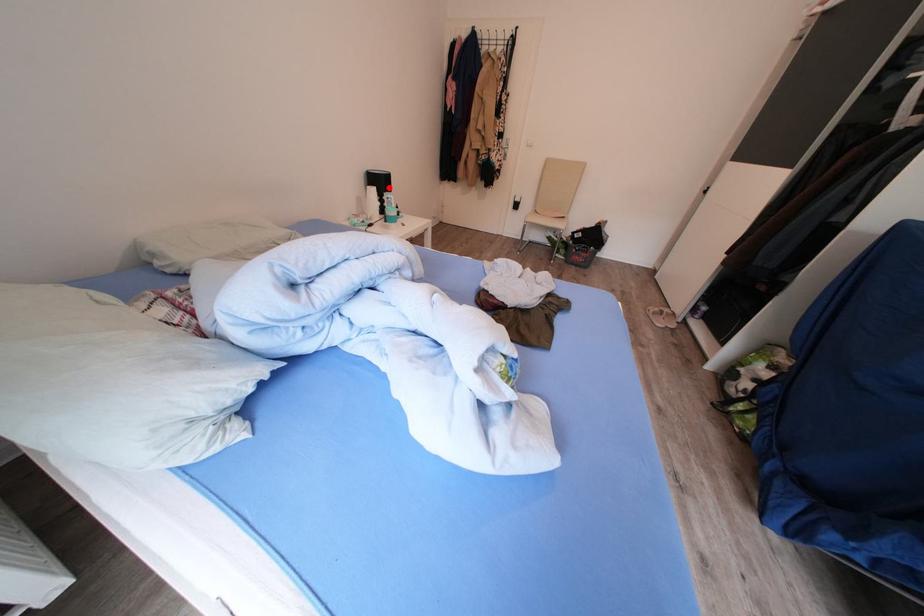
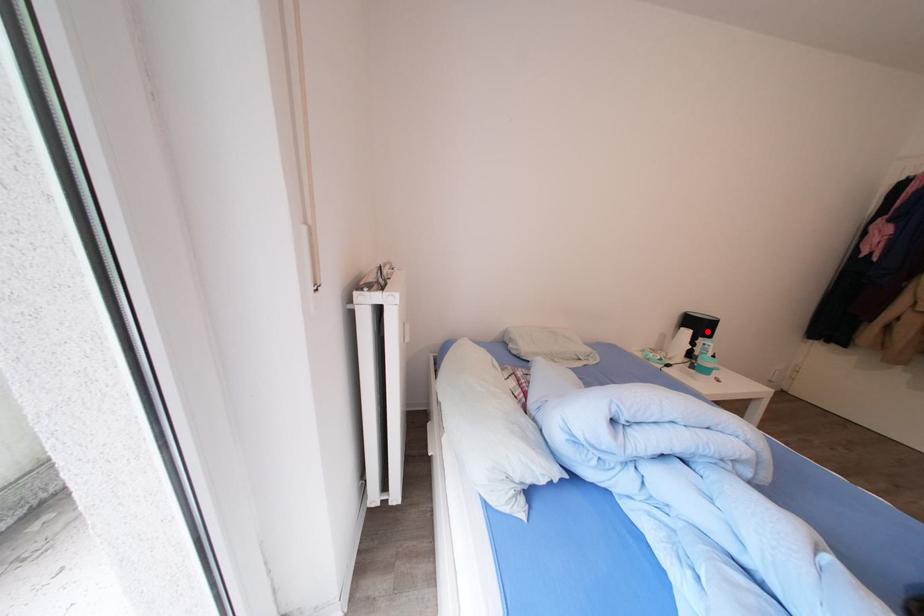
I am providing you with two images of the same scene from different viewpoints. A red point is marked on the first image and another point is marked on the second image. Is the red point in image1 aligned with the point shown in image2?

Yes